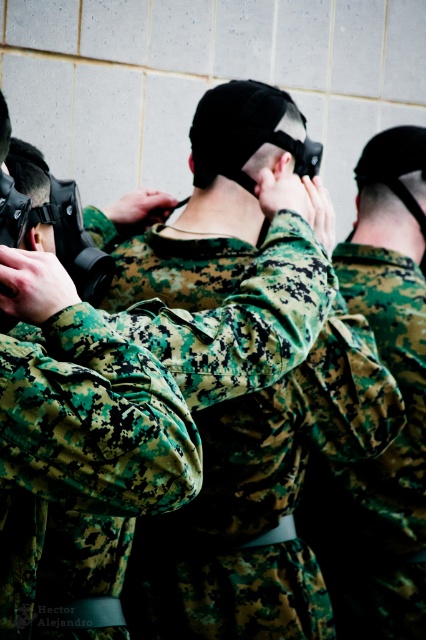
Can you confirm if camouflage fabric uniform at center is bigger than camouflage fabric at center?

Correct, camouflage fabric uniform at center is larger in size than camouflage fabric at center.

Can you confirm if camouflage fabric uniform at center is smaller than camouflage fabric at center?

Actually, camouflage fabric uniform at center might be larger than camouflage fabric at center.

At what (x,y) coordinates should I click in order to perform the action: click on camouflage fabric uniform at center. Please return your answer as a coordinate pair (x, y). This screenshot has height=640, width=426. Looking at the image, I should click on (261, 499).